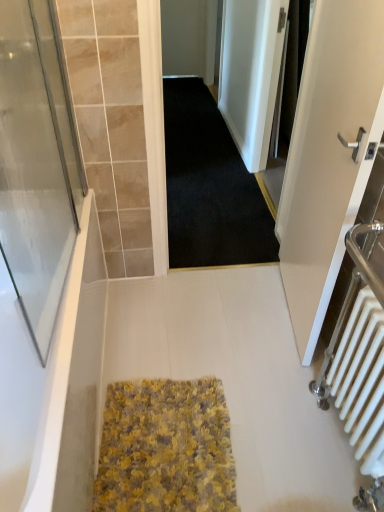
Question: Does transparent glass screen door at left, the second screen door when ordered from right to left, appear on the left side of white matte door at right?

Choices:
 (A) no
 (B) yes

Answer: (B)

Question: Does transparent glass screen door at left, the 1th screen door positioned from the bottom, have a smaller size compared to white matte door at right?

Choices:
 (A) yes
 (B) no

Answer: (A)

Question: Is transparent glass screen door at left, the 1th screen door positioned from the bottom, in contact with white matte door at right?

Choices:
 (A) yes
 (B) no

Answer: (B)

Question: Considering the relative sizes of transparent glass screen door at left, the second screen door positioned from the back, and white matte door at right in the image provided, is transparent glass screen door at left, the second screen door positioned from the back, taller than white matte door at right?

Choices:
 (A) no
 (B) yes

Answer: (A)

Question: Is transparent glass screen door at left, the second screen door positioned from the back, looking in the opposite direction of white matte door at right?

Choices:
 (A) yes
 (B) no

Answer: (B)

Question: Is transparent glass screen door at left, positioned as the second screen door in top-to-bottom order, thinner than white matte door at right?

Choices:
 (A) yes
 (B) no

Answer: (A)

Question: Could you tell me if yellow textured rug at center is turned towards transparent glass screen door at left, positioned as the second screen door in top-to-bottom order?

Choices:
 (A) no
 (B) yes

Answer: (A)

Question: Would you say yellow textured rug at center is outside transparent glass screen door at left, positioned as the second screen door in top-to-bottom order?

Choices:
 (A) yes
 (B) no

Answer: (A)

Question: From a real-world perspective, does yellow textured rug at center stand above transparent glass screen door at left, the second screen door when ordered from right to left?

Choices:
 (A) no
 (B) yes

Answer: (A)

Question: Does yellow textured rug at center have a smaller size compared to transparent glass screen door at left, the 1th screen door positioned from the bottom?

Choices:
 (A) yes
 (B) no

Answer: (A)

Question: Is transparent glass screen door at left, the second screen door positioned from the back, at the back of yellow textured rug at center?

Choices:
 (A) yes
 (B) no

Answer: (B)

Question: Is yellow textured rug at center thinner than transparent glass screen door at left, the second screen door positioned from the back?

Choices:
 (A) no
 (B) yes

Answer: (A)

Question: From a real-world perspective, is white matte door at right below yellow textured rug at center?

Choices:
 (A) no
 (B) yes

Answer: (A)